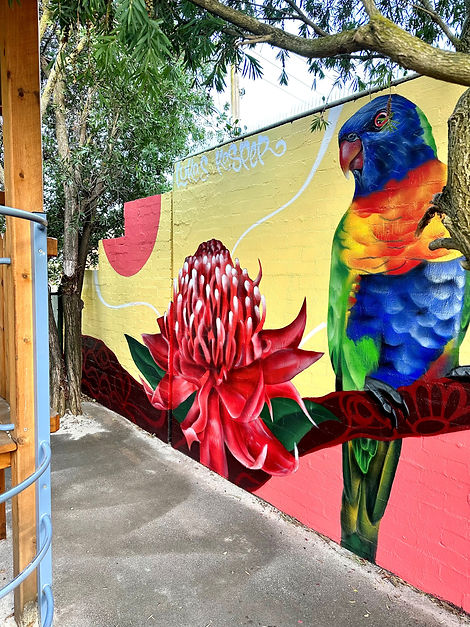
Where is `mural painting of red circle`? Image resolution: width=470 pixels, height=627 pixels. mural painting of red circle is located at coordinates (135, 226).